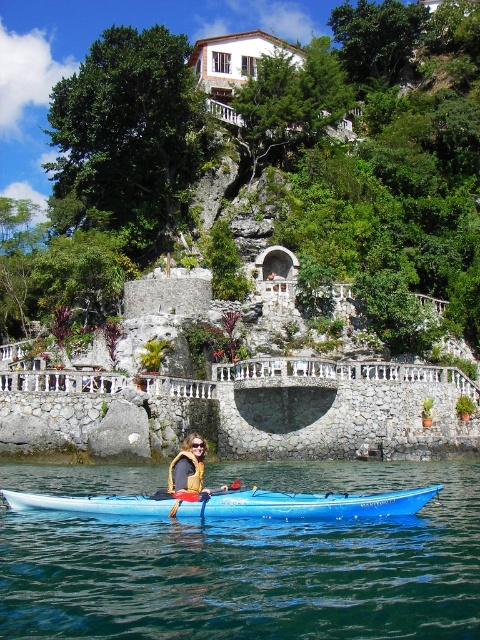
Can you confirm if yellow life vest at center is shorter than blue plastic paddle at center?

In fact, yellow life vest at center may be taller than blue plastic paddle at center.

Based on the photo, is yellow life vest at center below blue plastic paddle at center?

No.

Which is behind, point (197, 481) or point (236, 481)?

Positioned behind is point (236, 481).

Identify the location of yellow life vest at center. The width and height of the screenshot is (480, 640). (189, 467).

Who is lower down, blue plastic kayak at center or yellow fabric life jacket at center?

blue plastic kayak at center is lower down.

Is blue plastic kayak at center below yellow fabric life jacket at center?

Yes, blue plastic kayak at center is below yellow fabric life jacket at center.

You are a GUI agent. You are given a task and a screenshot of the screen. Output one action in this format:
    pyautogui.click(x=<x>, y=<y>)
    Task: Click on the blue plastic kayak at center
    This screenshot has width=480, height=640.
    Given the screenshot: What is the action you would take?
    pyautogui.click(x=232, y=502)

Measure the distance between yellow life vest at center and yellow fabric life jacket at center.

The distance of yellow life vest at center from yellow fabric life jacket at center is 81.38 centimeters.

At what (x,y) coordinates should I click in order to perform the action: click on yellow life vest at center. Please return your answer as a coordinate pair (x, y). Looking at the image, I should click on (189, 467).